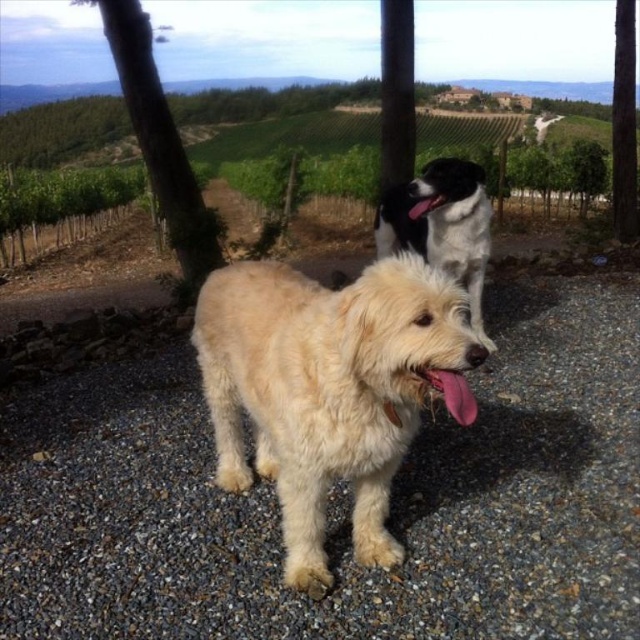
Does white gravel at center have a smaller size compared to fuzzy beige dog at center?

Incorrect, white gravel at center is not smaller in size than fuzzy beige dog at center.

Is white gravel at center below fuzzy beige dog at center?

Yes, white gravel at center is below fuzzy beige dog at center.

Where is `white gravel at center`? This screenshot has width=640, height=640. white gravel at center is located at coordinates (340, 500).

Who is more forward, [116,570] or [380,244]?

Point [116,570]

Does white gravel at center appear under black and white fur dog at upper center?

Yes, white gravel at center is below black and white fur dog at upper center.

Is point (54, 420) behind point (474, 268)?

No, it is in front of (474, 268).

This screenshot has width=640, height=640. What are the coordinates of `white gravel at center` in the screenshot? It's located at (340, 500).

Between point (220, 276) and point (468, 285), which one is positioned in front?

Point (220, 276) is in front.

At what (x,y) coordinates should I click in order to perform the action: click on fuzzy beige dog at center. Please return your answer as a coordinate pair (x, y). This screenshot has height=640, width=640. Looking at the image, I should click on (330, 388).

The width and height of the screenshot is (640, 640). Find the location of `fuzzy beige dog at center`. fuzzy beige dog at center is located at coordinates (330, 388).